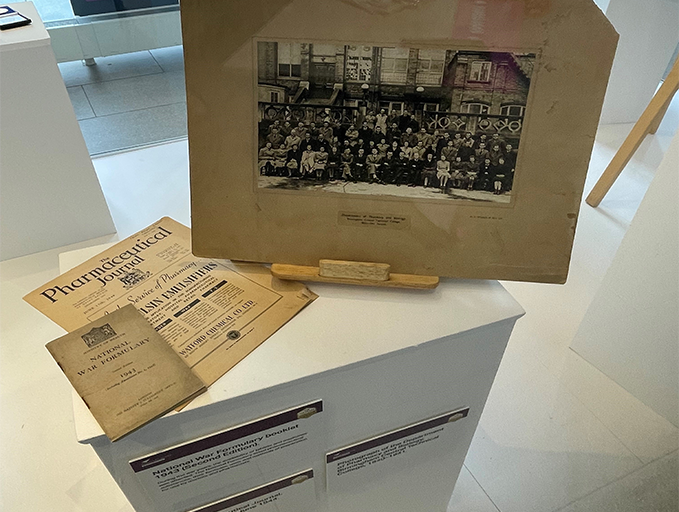
You are a GUI agent. You are given a task and a screenshot of the screen. Output one action in this format:
    pyautogui.click(x=<x>, y=<y>)
    Task: Click on the picture
    The image size is (679, 512).
    Given the screenshot: What is the action you would take?
    pyautogui.click(x=388, y=150)